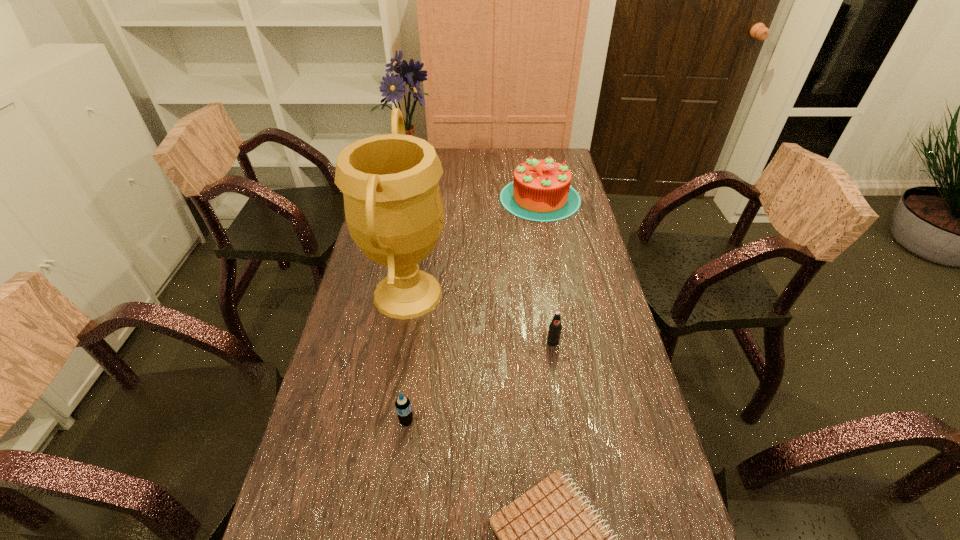
I want to click on free space between the flower arrangement and the right soda bottle, so click(483, 268).

You are a GUI agent. You are given a task and a screenshot of the screen. Output one action in this format:
    pyautogui.click(x=<x>, y=<y>)
    Task: Click on the object that is the fifth closest one to the third tallest object
    Image resolution: width=960 pixels, height=540 pixels.
    Given the screenshot: What is the action you would take?
    pyautogui.click(x=549, y=539)

The height and width of the screenshot is (540, 960). In order to click on the closest object relative to the farther soda bottle in this screenshot , I will do `click(394, 211)`.

This screenshot has width=960, height=540. What are the coordinates of `vacant position in the image that satisfies the following two spatial constraints: 1. on the engravings side of the nearer soda bottle; 2. on the left side of the trophy` in the screenshot? It's located at (386, 421).

Where is `free space that satisfies the following two spatial constraints: 1. on the back side of the nearer soda bottle; 2. on the engravings side of the trophy`? The image size is (960, 540). free space that satisfies the following two spatial constraints: 1. on the back side of the nearer soda bottle; 2. on the engravings side of the trophy is located at coordinates (423, 294).

Where is `vacant space that satisfies the following two spatial constraints: 1. on the front side of the left soda bottle; 2. on the left side of the flower arrangement`? This screenshot has height=540, width=960. vacant space that satisfies the following two spatial constraints: 1. on the front side of the left soda bottle; 2. on the left side of the flower arrangement is located at coordinates (365, 421).

The width and height of the screenshot is (960, 540). Identify the location of vacant area that satisfies the following two spatial constraints: 1. on the back side of the third tallest object; 2. on the left side of the second nearest object. (436, 198).